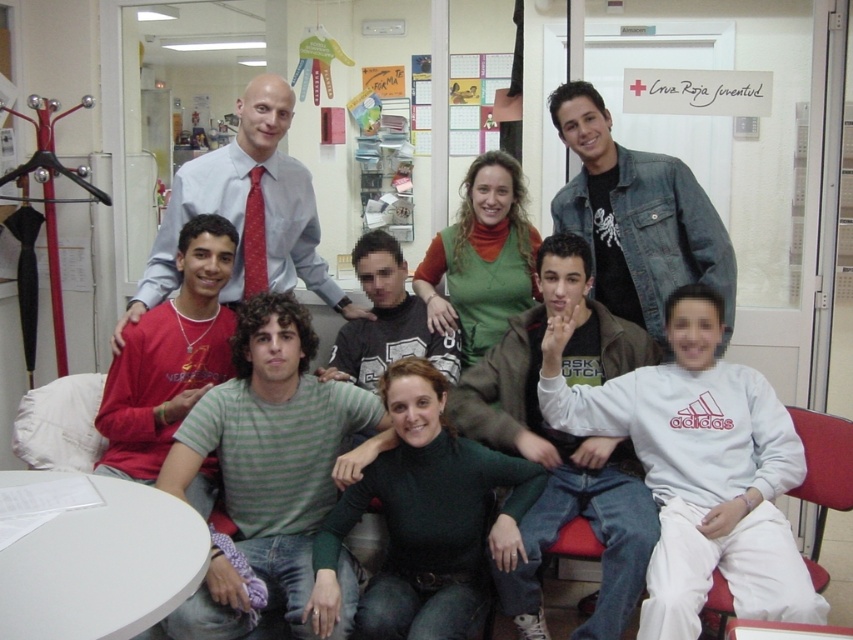
Is green matte turtleneck at center to the left of light blue shirt at center from the viewer's perspective?

No, green matte turtleneck at center is not to the left of light blue shirt at center.

Is green matte turtleneck at center below light blue shirt at center?

Yes.

Describe the element at coordinates (424, 518) in the screenshot. Image resolution: width=853 pixels, height=640 pixels. I see `green matte turtleneck at center` at that location.

Find the location of a particular element. The height and width of the screenshot is (640, 853). green matte turtleneck at center is located at coordinates pyautogui.click(x=424, y=518).

Between point (329, 387) and point (230, 180), which one is positioned behind?

The point (230, 180) is more distant.

Which is in front, point (199, 410) or point (213, 168)?

Positioned in front is point (199, 410).

This screenshot has width=853, height=640. Find the location of `green striped shirt at center`. green striped shirt at center is located at coordinates (273, 444).

Can you confirm if dark brown leather jacket at center is positioned below light blue shirt at center?

Yes.

Between point (514, 419) and point (256, 180), which one is positioned behind?

The point (256, 180) is more distant.

Which is behind, point (496, 429) or point (264, 264)?

Point (264, 264)

Identify the location of dark brown leather jacket at center. The height and width of the screenshot is (640, 853). (564, 442).